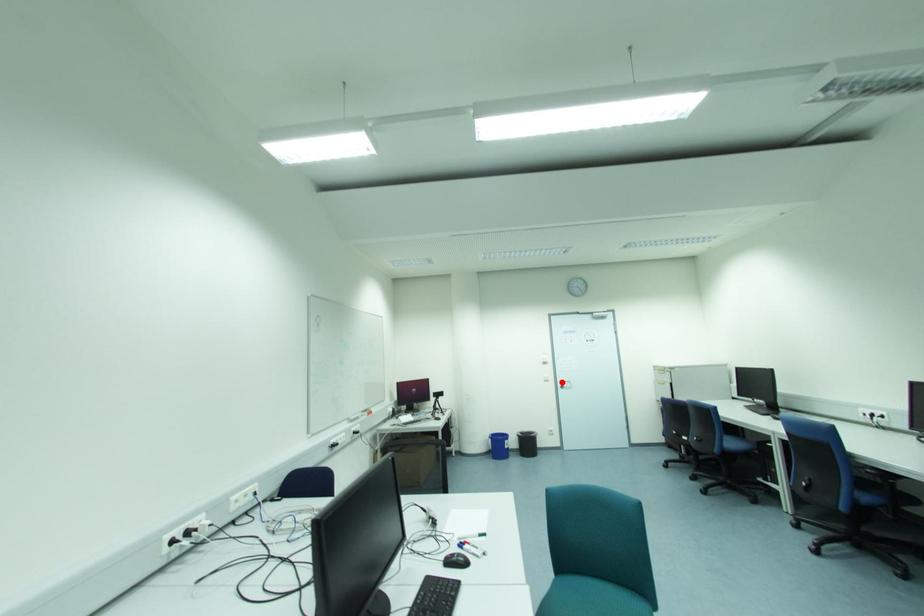
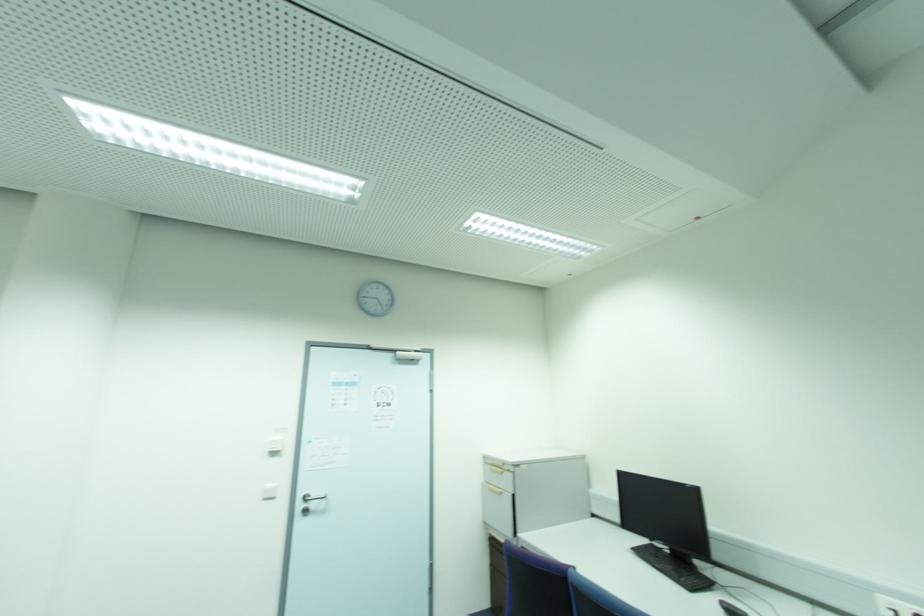
The point at the highlighted location is marked in the first image. Where is the corresponding point in the second image?

(306, 500)